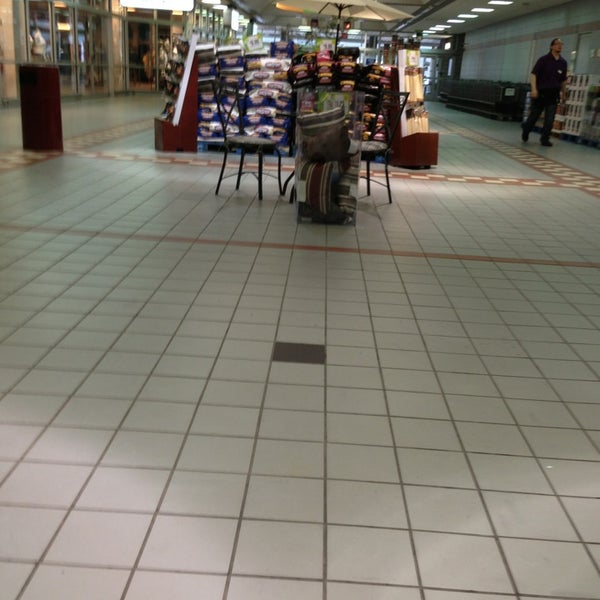
Identify the location of single dark gray tile. The height and width of the screenshot is (600, 600). (299, 351).